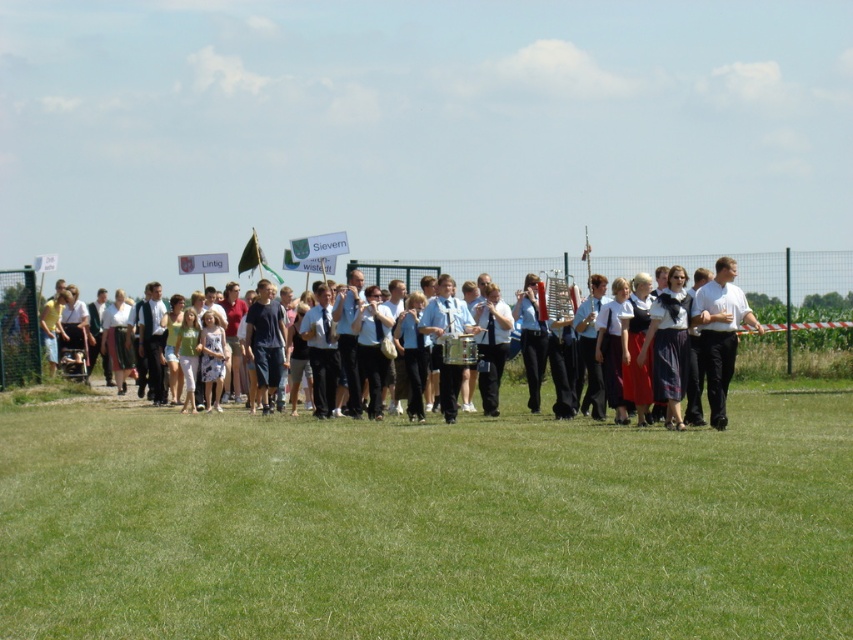
You are a photographer standing at the edge of the field. You want to take a photo that includes both the green grass at center and the light blue fabric dress at center. Which object should you focus on first to ensure both are in sharp focus?

You should focus on the green grass at center first because it is closer to the viewer than the light blue fabric dress at center. By focusing on the closer object, the depth of field may help keep both in focus.

In the scene shown: You are a photographer trying to capture a clear shot of the white matte shirt at center. Since the green grass at center is in front of the shirt, will the grass block the view of the shirt?

The green grass at center has a lesser height compared to the white matte shirt at center, so the grass will not block the view of the shirt as it is shorter than the shirt.

You are a photographer positioned at the back of the field, aiming to capture both the light blue fabric dress at center and the white matte shirt at center in your shot. Which of the two clothing items will appear closer to the camera in the photo?

The light blue fabric dress at center will appear closer to the camera because it is positioned further to the viewer than the white matte shirt at center.